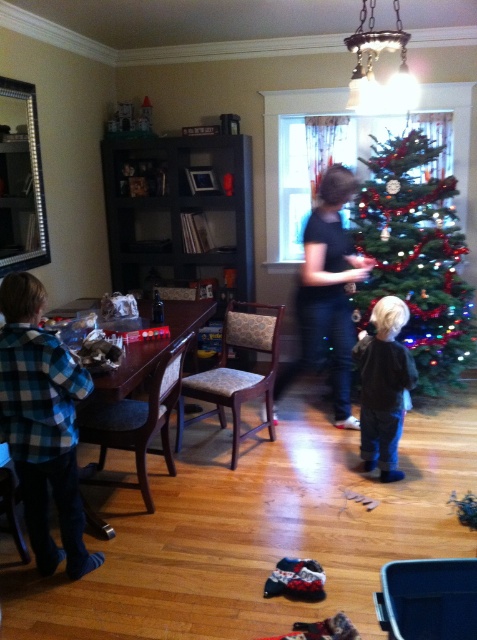
Which is behind, point (446, 180) or point (383, 392)?

The point (446, 180) is behind.

The height and width of the screenshot is (640, 477). What do you see at coordinates (415, 256) in the screenshot? I see `green shiny christmas tree at right` at bounding box center [415, 256].

Image resolution: width=477 pixels, height=640 pixels. I want to click on green shiny christmas tree at right, so click(415, 256).

Between point (413, 204) and point (309, 257), which one is positioned in front?

Point (309, 257) is more forward.

Which is below, green shiny christmas tree at right or black matte shirt at center?

black matte shirt at center is lower down.

Measure the distance between point [426,284] and camera.

Point [426,284] and camera are 3.95 meters apart.

Where is `green shiny christmas tree at right`? The image size is (477, 640). green shiny christmas tree at right is located at coordinates (415, 256).

Between point (339, 196) and point (362, 352), which one is positioned in front?

Point (362, 352) is in front.

Who is lower down, black matte shirt at center or black velvet jacket at center?

black velvet jacket at center is lower down.

At what (x,y) coordinates should I click in order to perform the action: click on black matte shirt at center. Please return your answer as a coordinate pair (x, y). Looking at the image, I should click on (327, 292).